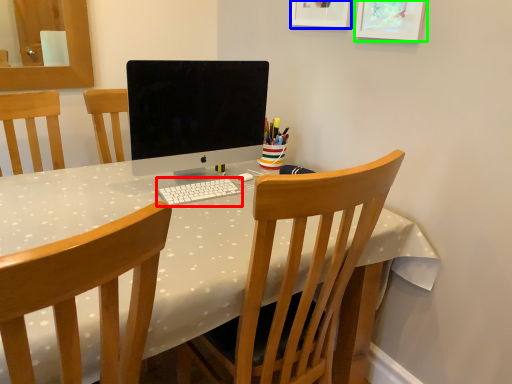
Question: Which object is the closest to the computer keyboard (highlighted by a red box)? Choose among these: picture frame (highlighted by a blue box) or picture frame (highlighted by a green box).

Choices:
 (A) picture frame
 (B) picture frame

Answer: (B)